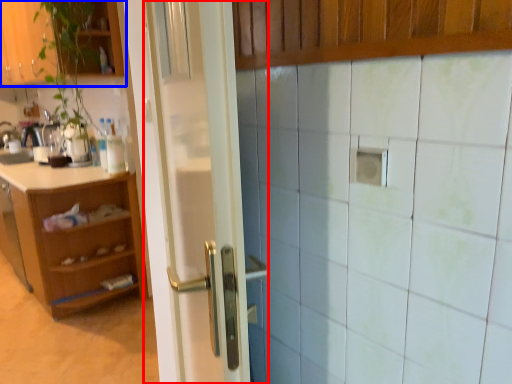
Question: Among these objects, which one is farthest to the camera, door (highlighted by a red box) or cabinetry (highlighted by a blue box)?

Choices:
 (A) door
 (B) cabinetry

Answer: (B)